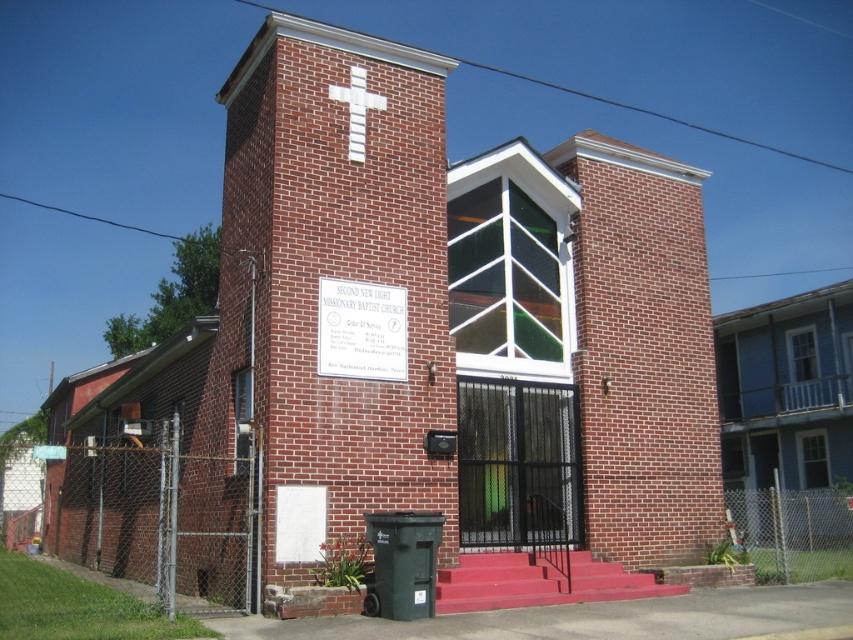
You are standing in front of the church and want to read the white plastic sign at center. Considering the distance, can you read the text on the sign without moving closer?

The white plastic sign at center is 37.27 feet away from the viewer, so it might be difficult to read the text clearly without moving closer.

You are a visitor approaching the church and notice two white objects in the scene. One is the white plastic sign at center and the other is the white painted cross at upper center. Which of these two objects appears wider from your viewpoint?

The white plastic sign at center might be wider than white painted cross at upper center according to the description provided.